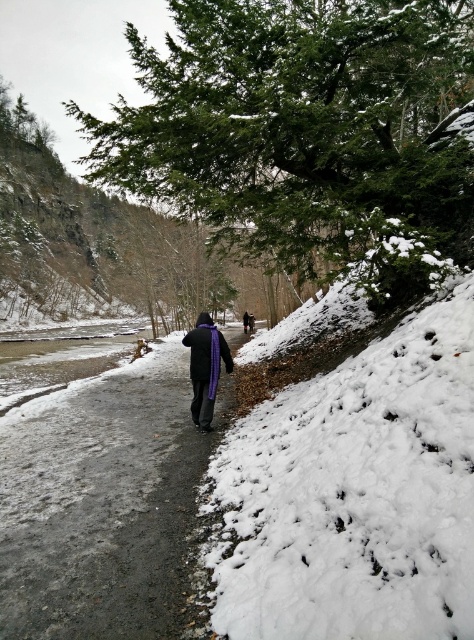
You are a hiker who wants to walk along the gray gravel path at center while keeping a safe distance from the purple fleece sweatshirt at center. The recommended safe distance is 5 feet. Can you walk along the path without getting too close?

The distance between the gray gravel path at center and the purple fleece sweatshirt at center is 6.77 feet, which is greater than the recommended 5 feet safe distance. Therefore, you can walk along the gray gravel path at center without getting too close to the purple fleece sweatshirt at center.

You are standing at the start of the gray gravel path at center and want to catch up to the person wearing the purple fleece sweatshirt at center. Since the path is narrow, you need to know if you can pass them without stepping off the path. Can you do so?

The gray gravel path at center is located below the purple fleece sweatshirt at center, meaning the path is beneath the person. Since the path is narrow, you can pass them by staying on the path as it extends below them, but you may need to adjust your path slightly to avoid collision.

You are standing at the start of the path and want to reach the end. Which object would you see first as you walk along the path? The green textured pine at upper center or the gray gravel path at center?

The gray gravel path at center is behind the green textured pine at upper center, so you would see the green textured pine at upper center first as you walk along the path.